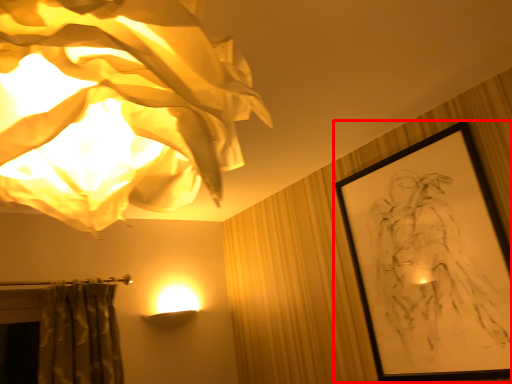
Question: From the image, what is the correct spatial relationship of picture frame (annotated by the red box) in relation to lamp?

Choices:
 (A) left
 (B) right

Answer: (B)